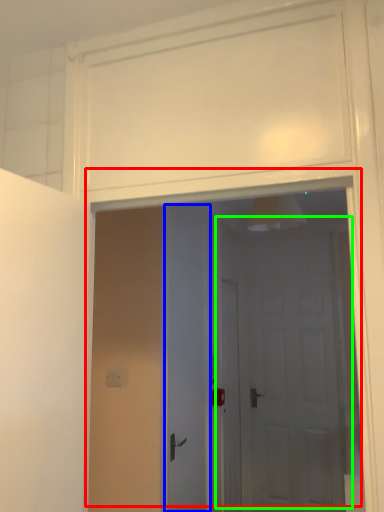
Question: Based on their relative distances, which object is farther from door (highlighted by a red box)? Choose from door (highlighted by a blue box) and door (highlighted by a green box).

Choices:
 (A) door
 (B) door

Answer: (A)